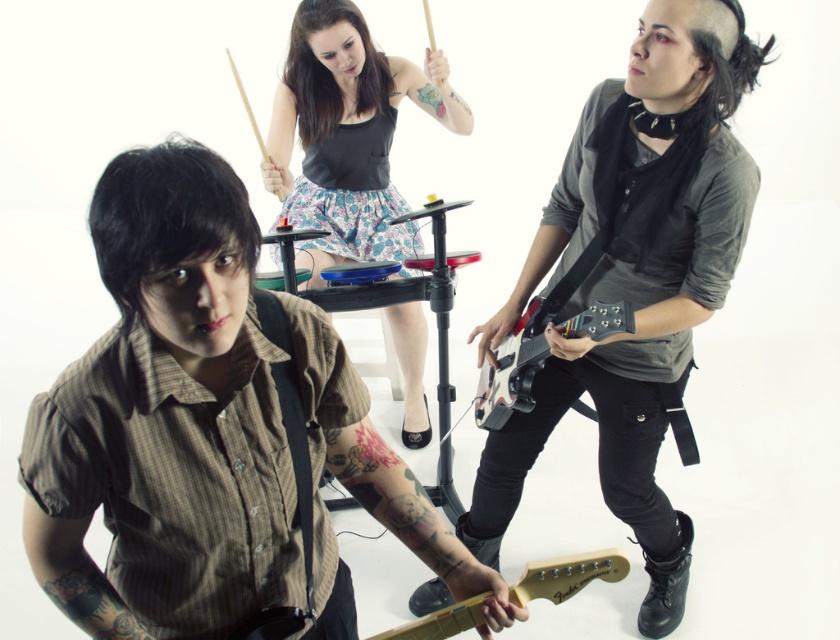
You are a photographer setting up for a photoshoot and need to ensure that the brown striped shirt at center and the shiny black electric guitar at right are both visible in the frame. Given their sizes, which object should you prioritize positioning closer to the camera to maintain clarity and detail?

The brown striped shirt at center is wider than the shiny black electric guitar at right, so you should prioritize positioning the brown striped shirt at center closer to the camera to maintain clarity and detail.

Based on the scene description, which guitar is taller when comparing the matte black guitar at center and the light wood electric guitar at center?

The matte black guitar at center is taller than the light wood electric guitar at center according to the description.

You are a photographer setting up a shoot for a music group. You need to place a microphone exactly at point (633, 276). What object will the microphone be placed on?

The microphone will be placed on the matte black guitar at center located at point (633, 276).